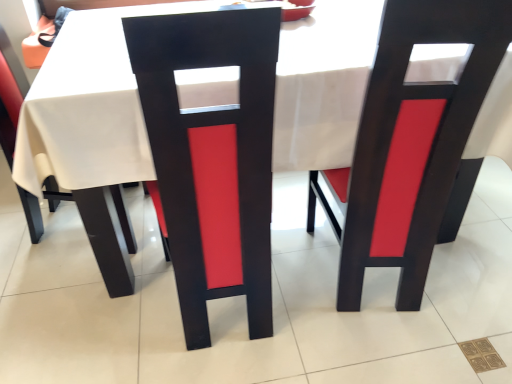
Locate an element on the screen. This screenshot has width=512, height=384. vacant space that is in between matte black chair at center, positioned as the 2th chair in left-to-right order, and matte black chair at center, which is the 3th chair from left to right is located at coordinates (305, 288).